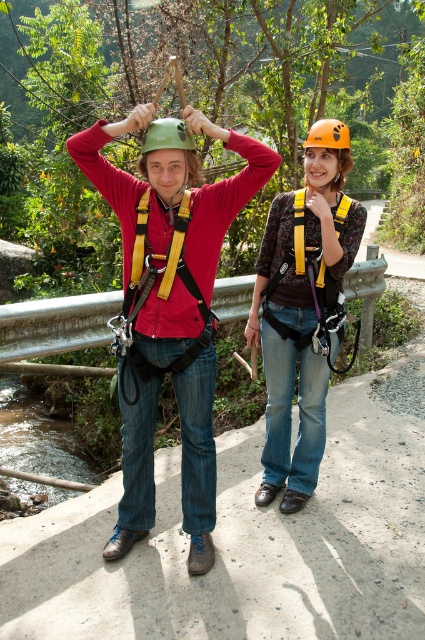
Find the location of a particular element. This screenshot has width=425, height=640. matte orange helmet at center is located at coordinates (302, 308).

Can you confirm if matte orange helmet at center is wider than orange matte helmet at upper center?

Yes, matte orange helmet at center is wider than orange matte helmet at upper center.

Where is `matte orange helmet at center`? The width and height of the screenshot is (425, 640). matte orange helmet at center is located at coordinates (x=302, y=308).

Find the location of `matte orange helmet at center`. matte orange helmet at center is located at coordinates point(302,308).

Does matte orange helmet at center appear on the left side of green matte helmet at center?

Incorrect, matte orange helmet at center is not on the left side of green matte helmet at center.

Who is positioned more to the left, matte orange helmet at center or green matte helmet at center?

From the viewer's perspective, green matte helmet at center appears more on the left side.

Does point (251, 339) come in front of point (142, 163)?

No.

In order to click on matte orange helmet at center in this screenshot , I will do `click(302, 308)`.

Is matte green helmet at upper left further to the viewer compared to orange matte helmet at upper center?

No, matte green helmet at upper left is in front of orange matte helmet at upper center.

Does point (150, 362) lie in front of point (333, 128)?

Yes.

At what (x,y) coordinates should I click in order to perform the action: click on matte green helmet at upper left. Please return your answer as a coordinate pair (x, y). This screenshot has width=425, height=640. Looking at the image, I should click on (169, 310).